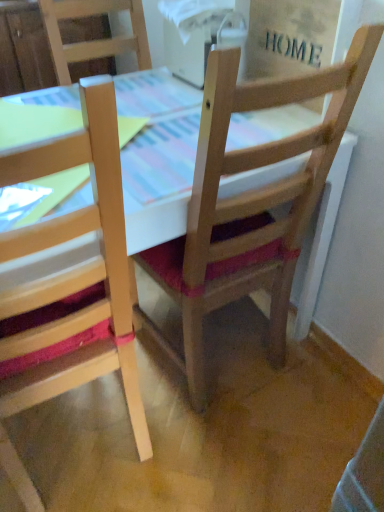
Where is `vacant space situated above wooden table at center (from a real-world perspective)`? The width and height of the screenshot is (384, 512). vacant space situated above wooden table at center (from a real-world perspective) is located at coordinates click(132, 123).